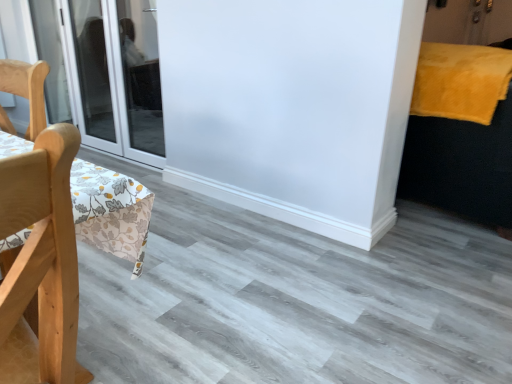
The width and height of the screenshot is (512, 384). What do you see at coordinates (460, 81) in the screenshot?
I see `yellow fluffy blanket at upper right` at bounding box center [460, 81].

Find the location of a particular element. Image resolution: width=512 pixels, height=384 pixels. yellow fluffy blanket at upper right is located at coordinates (460, 81).

Locate an element on the screen. Image resolution: width=512 pixels, height=384 pixels. yellow fluffy blanket at upper right is located at coordinates (460, 81).

Is transparent glass door at left bigger or smaller than yellow fluffy blanket at upper right?

Clearly, transparent glass door at left is larger in size than yellow fluffy blanket at upper right.

Can we say transparent glass door at left lies outside yellow fluffy blanket at upper right?

Yes, transparent glass door at left is located beyond the bounds of yellow fluffy blanket at upper right.

Which is in front, transparent glass door at left or yellow fluffy blanket at upper right?

yellow fluffy blanket at upper right is closer to the camera.

Considering the positions of point (145, 148) and point (477, 109), is point (145, 148) closer or farther from the camera than point (477, 109)?

Point (145, 148).

From the picture: Would you say light wood chair at left contains velvet yellow bed at right?

Definitely not — velvet yellow bed at right is not inside light wood chair at left.

From a real-world perspective, is light wood chair at left above or below velvet yellow bed at right?

light wood chair at left is above velvet yellow bed at right.

Which is behind, light wood chair at left or velvet yellow bed at right?

velvet yellow bed at right is further away from the camera.

Considering the relative sizes of light wood chair at left and velvet yellow bed at right in the image provided, is light wood chair at left wider than velvet yellow bed at right?

In fact, light wood chair at left might be narrower than velvet yellow bed at right.

Looking at this image, can you tell me how much velvet yellow bed at right and yellow fluffy blanket at upper right differ in facing direction?

They differ by 3.22 degrees in their facing directions.

Is point (508, 199) behind point (501, 99)?

Yes, point (508, 199) is farther from viewer.

From a real-world perspective, is velvet yellow bed at right physically below yellow fluffy blanket at upper right?

Yes, from a real-world perspective, velvet yellow bed at right is below yellow fluffy blanket at upper right.

Is transparent glass door at left completely or partially outside of velvet yellow bed at right?

Indeed, transparent glass door at left is completely outside velvet yellow bed at right.

In the image, there is a transparent glass door at left. In order to click on bed below it (from the image's perspective) in this screenshot , I will do `click(462, 166)`.

Does transparent glass door at left touch velvet yellow bed at right?

They are not placed beside each other.

Which object is positioned more to the left, transparent glass door at left or velvet yellow bed at right?

transparent glass door at left is more to the left.

From the image's perspective, which one is positioned lower, velvet yellow bed at right or light wood chair at left?

light wood chair at left, from the image's perspective.

Is velvet yellow bed at right oriented towards light wood chair at left?

No, velvet yellow bed at right is not oriented towards light wood chair at left.

Considering the relative sizes of velvet yellow bed at right and light wood chair at left in the image provided, is velvet yellow bed at right wider than light wood chair at left?

Yes.

Considering the sizes of objects velvet yellow bed at right and light wood chair at left in the image provided, who is taller, velvet yellow bed at right or light wood chair at left?

Standing taller between the two is velvet yellow bed at right.

Looking at the image, does yellow fluffy blanket at upper right seem bigger or smaller compared to velvet yellow bed at right?

yellow fluffy blanket at upper right is smaller than velvet yellow bed at right.

From the image's perspective, is yellow fluffy blanket at upper right on top of velvet yellow bed at right?

Correct, yellow fluffy blanket at upper right appears higher than velvet yellow bed at right in the image.

Is yellow fluffy blanket at upper right oriented towards velvet yellow bed at right?

Yes, yellow fluffy blanket at upper right faces towards velvet yellow bed at right.

Which object is positioned more to the left, yellow fluffy blanket at upper right or velvet yellow bed at right?

From the viewer's perspective, yellow fluffy blanket at upper right appears more on the left side.

Could you tell me if yellow fluffy blanket at upper right is turned towards light wood chair at left?

No, yellow fluffy blanket at upper right is not facing towards light wood chair at left.

Which is closer to the camera, (488,72) or (41,178)?

Point (488,72) appears to be farther away from the viewer than point (41,178).

Based on the photo, from a real-world perspective, is yellow fluffy blanket at upper right physically above light wood chair at left?

Indeed, from a real-world perspective, yellow fluffy blanket at upper right stands above light wood chair at left.

Considering the relative positions of yellow fluffy blanket at upper right and light wood chair at left in the image provided, is yellow fluffy blanket at upper right to the left of light wood chair at left from the viewer's perspective?

Incorrect, yellow fluffy blanket at upper right is not on the left side of light wood chair at left.

The height and width of the screenshot is (384, 512). Find the location of `door beneath the yellow fluffy blanket at upper right (from a real-world perspective)`. door beneath the yellow fluffy blanket at upper right (from a real-world perspective) is located at coordinates (116, 76).

Find the location of a particular element. This screenshot has height=384, width=512. chair that appears above the velvet yellow bed at right (from a real-world perspective) is located at coordinates (42, 256).

From the picture: Based on their spatial positions, is yellow fluffy blanket at upper right or transparent glass door at left further from velvet yellow bed at right?

The object further to velvet yellow bed at right is transparent glass door at left.

Looking at the image, which one is located closer to velvet yellow bed at right, light wood chair at left or yellow fluffy blanket at upper right?

Based on the image, yellow fluffy blanket at upper right appears to be nearer to velvet yellow bed at right.

From the picture: Considering their positions, is velvet yellow bed at right positioned further to transparent glass door at left than light wood chair at left?

light wood chair at left.

When comparing their distances from yellow fluffy blanket at upper right, does transparent glass door at left or velvet yellow bed at right seem closer?

The object closer to yellow fluffy blanket at upper right is velvet yellow bed at right.

Considering their positions, is yellow fluffy blanket at upper right positioned further to velvet yellow bed at right than light wood chair at left?

Among the two, light wood chair at left is located further to velvet yellow bed at right.

Considering their positions, is transparent glass door at left positioned closer to velvet yellow bed at right than light wood chair at left?

light wood chair at left lies closer to velvet yellow bed at right than the other object.

Estimate the real-world distances between objects in this image. Which object is closer to yellow fluffy blanket at upper right, light wood chair at left or transparent glass door at left?

light wood chair at left lies closer to yellow fluffy blanket at upper right than the other object.

When comparing their distances from light wood chair at left, does velvet yellow bed at right or yellow fluffy blanket at upper right seem closer?

The object closer to light wood chair at left is yellow fluffy blanket at upper right.

At what (x,y) coordinates should I click in order to perform the action: click on chair between transparent glass door at left and velvet yellow bed at right from left to right. Please return your answer as a coordinate pair (x, y). Looking at the image, I should click on (42, 256).

You are a GUI agent. You are given a task and a screenshot of the screen. Output one action in this format:
    pyautogui.click(x=<x>, y=<y>)
    Task: Click on the blanket located between transparent glass door at left and velvet yellow bed at right in the left-right direction
    
    Given the screenshot: What is the action you would take?
    pyautogui.click(x=460, y=81)

This screenshot has width=512, height=384. In order to click on blanket between light wood chair at left and velvet yellow bed at right from left to right in this screenshot , I will do `click(460, 81)`.

Find the location of a particular element. This screenshot has height=384, width=512. chair situated between transparent glass door at left and yellow fluffy blanket at upper right from left to right is located at coordinates (42, 256).